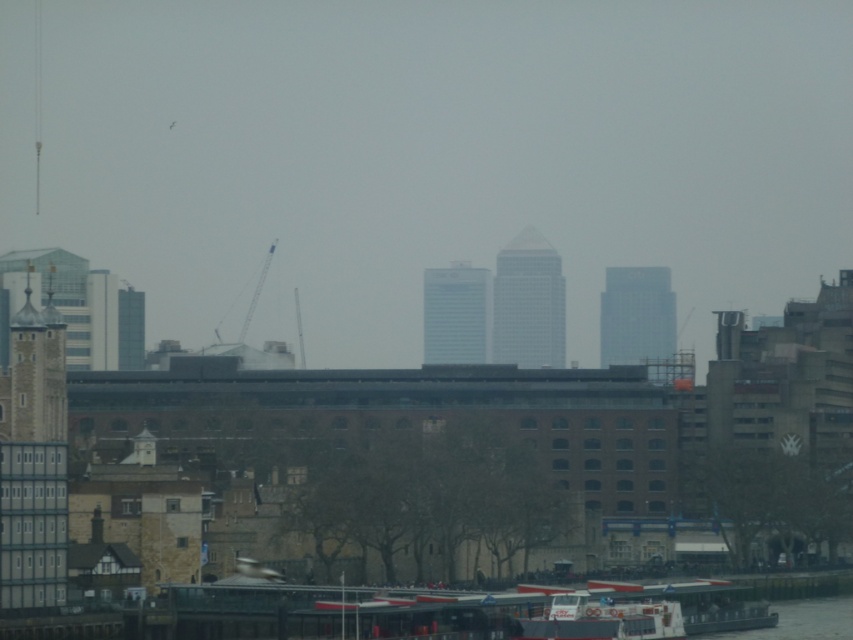
How distant is glassy silver skyscraper at center from light blue glass skyscraper at center?

glassy silver skyscraper at center is 8.05 meters from light blue glass skyscraper at center.

Between point (553, 317) and point (444, 305), which one is positioned behind?

Point (444, 305)

The height and width of the screenshot is (640, 853). Identify the location of glassy silver skyscraper at center. (527, 304).

Consider the image. Between stone tower at left and glassy gray skyscraper at center, which one has more height?

stone tower at left is taller.

Does point (18, 317) come closer to viewer compared to point (618, 296)?

Yes, point (18, 317) is in front of point (618, 296).

Image resolution: width=853 pixels, height=640 pixels. In order to click on stone tower at left in this screenshot , I will do `click(33, 374)`.

Who is positioned more to the right, stone tower at left or light blue glass skyscraper at center?

From the viewer's perspective, light blue glass skyscraper at center appears more on the right side.

Is stone tower at left thinner than light blue glass skyscraper at center?

No.

Is point (54, 436) farther from camera compared to point (489, 355)?

No, (54, 436) is closer to viewer.

You are a GUI agent. You are given a task and a screenshot of the screen. Output one action in this format:
    pyautogui.click(x=<x>, y=<y>)
    Task: Click on the stone tower at left
    The width and height of the screenshot is (853, 640).
    Given the screenshot: What is the action you would take?
    pyautogui.click(x=33, y=374)